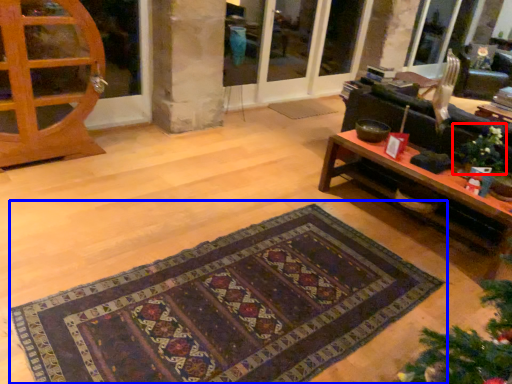
Question: Which point is further to the camera, christmas decoration (highlighted by a red box) or mat (highlighted by a blue box)?

Choices:
 (A) christmas decoration
 (B) mat

Answer: (A)